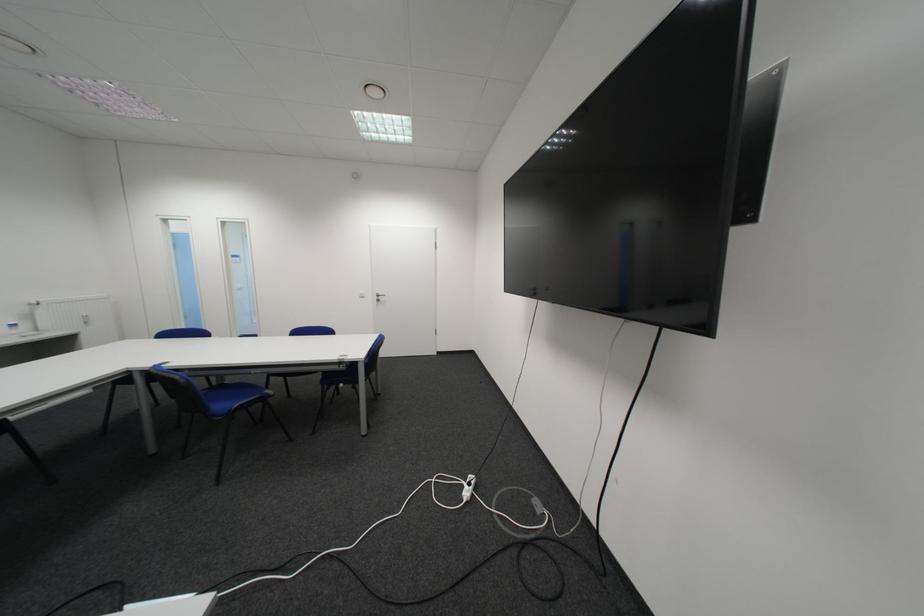
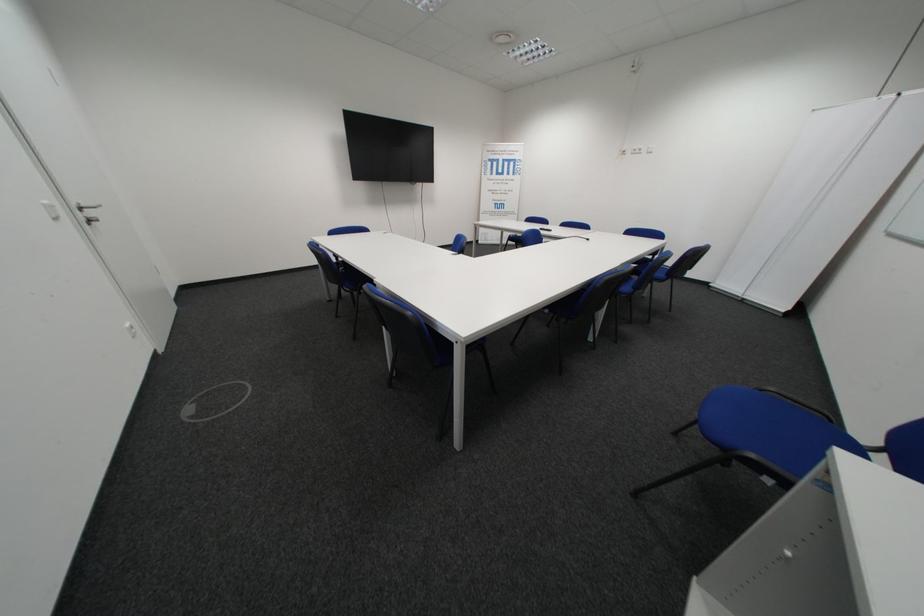
Find the pixel in the second image that matches (x=390, y=297) in the first image.

(93, 209)